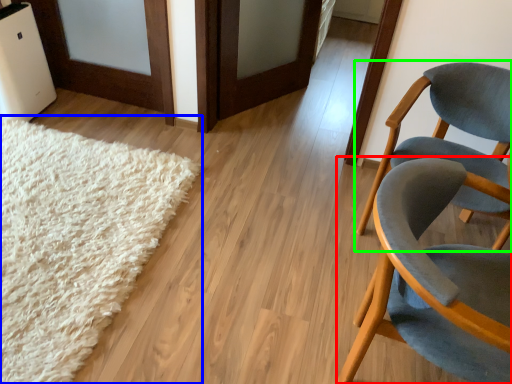
Question: Considering the real-world distances, which object is closest to chair (highlighted by a red box)? mat (highlighted by a blue box) or chair (highlighted by a green box).

Choices:
 (A) mat
 (B) chair

Answer: (B)